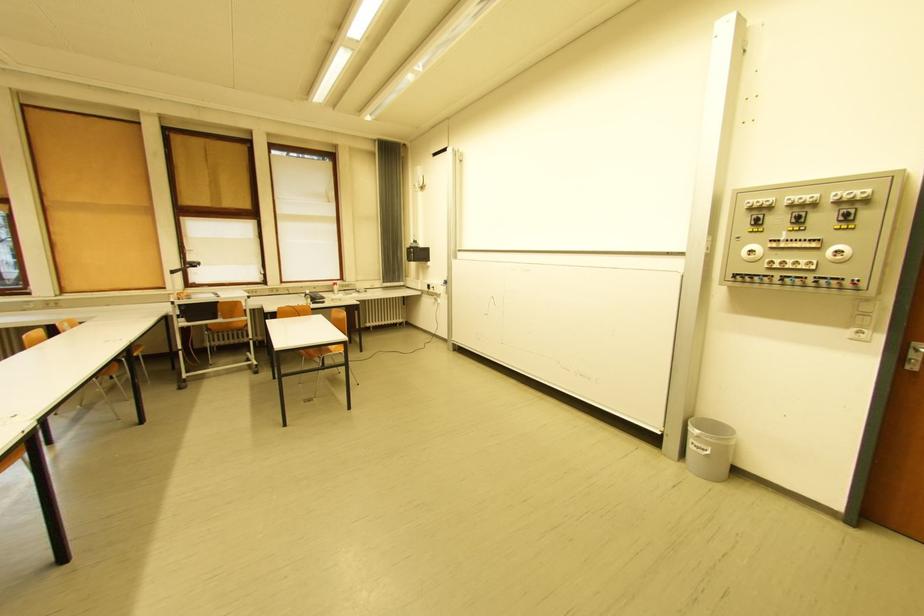
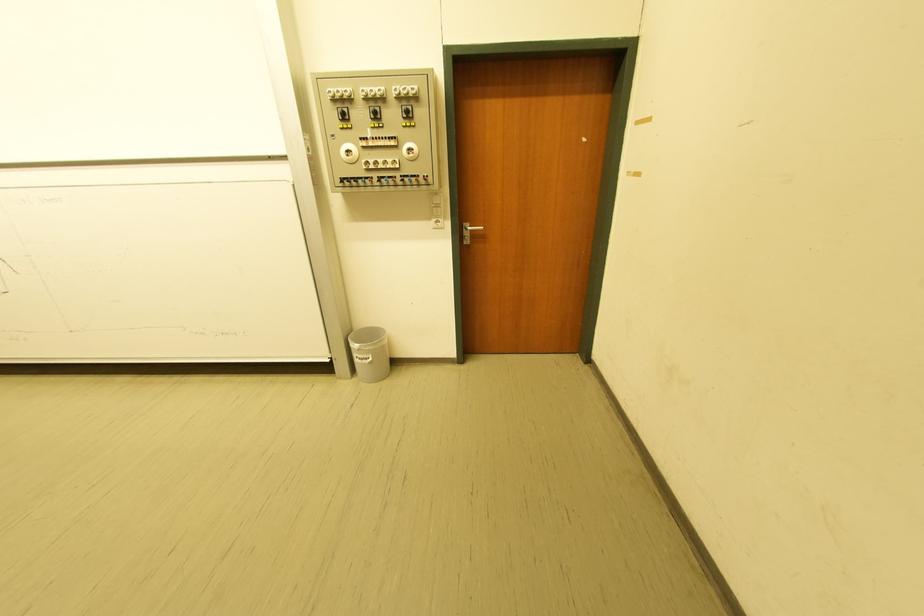
In the second image, find the point that corresponds to (x=759, y=253) in the first image.

(355, 153)